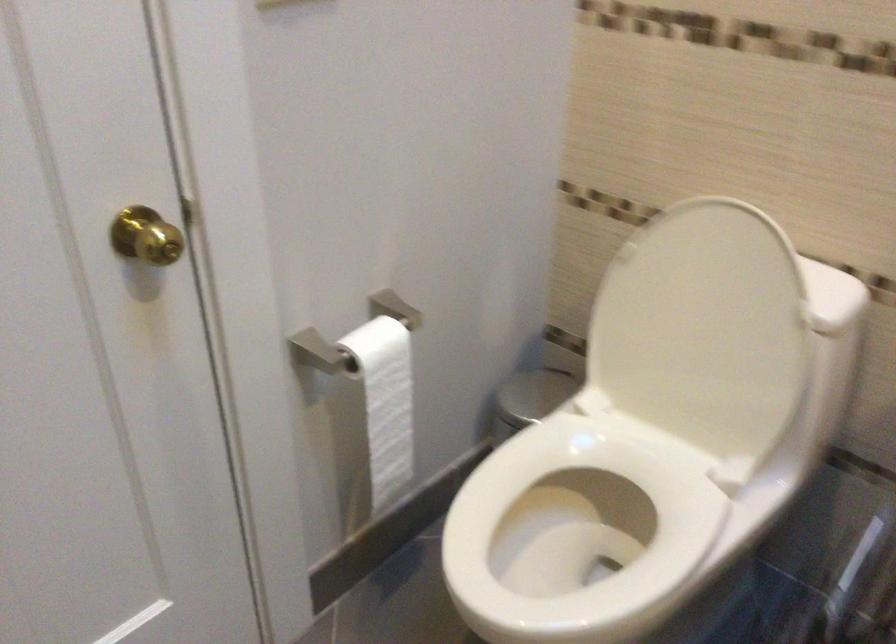
Find the location of a particular element. Image resolution: width=896 pixels, height=644 pixels. gold doorknob is located at coordinates (145, 236).